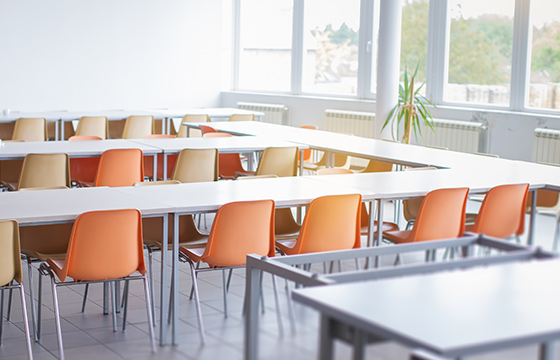
At what (x,y) coordinates should I click in order to perform the action: click on tables. Please return your answer as a coordinate pair (x, y). The width and height of the screenshot is (560, 360). Looking at the image, I should click on (186, 198), (368, 140), (170, 138), (123, 115).